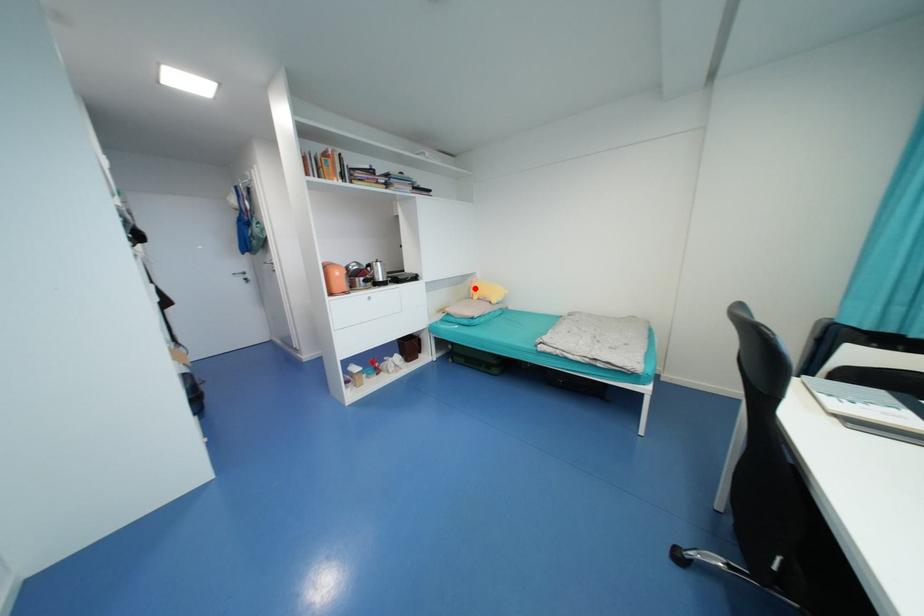
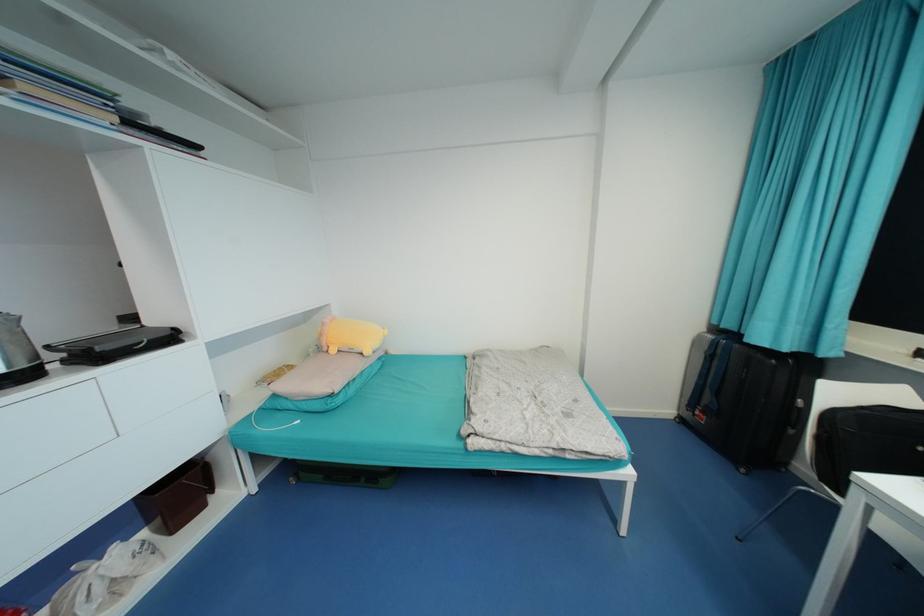
Where in the second image is the point corresponding to the highlighted location from the first image?

(325, 334)